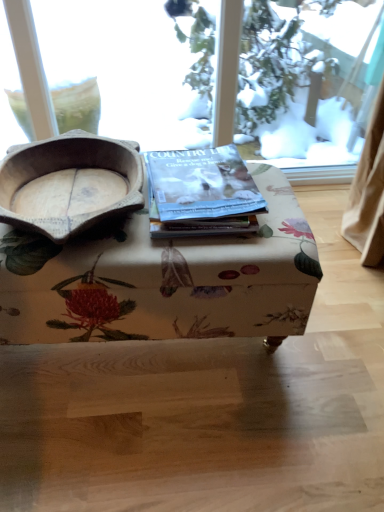
Question: Does floral fabric ottoman at center have a lesser width compared to wooden bowl at left?

Choices:
 (A) yes
 (B) no

Answer: (A)

Question: Does floral fabric ottoman at center have a greater height compared to wooden bowl at left?

Choices:
 (A) no
 (B) yes

Answer: (B)

Question: Is floral fabric ottoman at center shorter than wooden bowl at left?

Choices:
 (A) yes
 (B) no

Answer: (B)

Question: Is floral fabric ottoman at center behind wooden bowl at left?

Choices:
 (A) no
 (B) yes

Answer: (B)

Question: From a real-world perspective, is floral fabric ottoman at center positioned over wooden bowl at left based on gravity?

Choices:
 (A) yes
 (B) no

Answer: (B)

Question: Looking at the image, does floral fabric ottoman at center seem bigger or smaller compared to matte paper magazine at center?

Choices:
 (A) small
 (B) big

Answer: (B)

Question: From the image's perspective, is floral fabric ottoman at center located above or below matte paper magazine at center?

Choices:
 (A) above
 (B) below

Answer: (B)

Question: Is floral fabric ottoman at center taller or shorter than matte paper magazine at center?

Choices:
 (A) short
 (B) tall

Answer: (B)

Question: Does point (153, 283) appear closer or farther from the camera than point (206, 188)?

Choices:
 (A) farther
 (B) closer

Answer: (B)

Question: From a real-world perspective, is floral fabric ottoman at center above or below wooden bowl at left?

Choices:
 (A) above
 (B) below

Answer: (B)

Question: From their relative heights in the image, would you say floral fabric ottoman at center is taller or shorter than wooden bowl at left?

Choices:
 (A) short
 (B) tall

Answer: (B)

Question: Is floral fabric ottoman at center inside the boundaries of wooden bowl at left, or outside?

Choices:
 (A) inside
 (B) outside

Answer: (B)

Question: In the image, is floral fabric ottoman at center positioned in front of or behind wooden bowl at left?

Choices:
 (A) behind
 (B) front

Answer: (A)

Question: From a real-world perspective, relative to floral fabric ottoman at center, is matte paper magazine at center vertically above or below?

Choices:
 (A) above
 (B) below

Answer: (A)

Question: Relative to floral fabric ottoman at center, is matte paper magazine at center in front or behind?

Choices:
 (A) front
 (B) behind

Answer: (B)